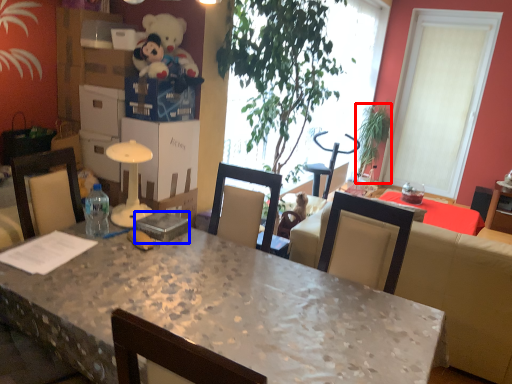
Question: Among these objects, which one is farthest to the camera, houseplant (highlighted by a red box) or box (highlighted by a blue box)?

Choices:
 (A) houseplant
 (B) box

Answer: (A)